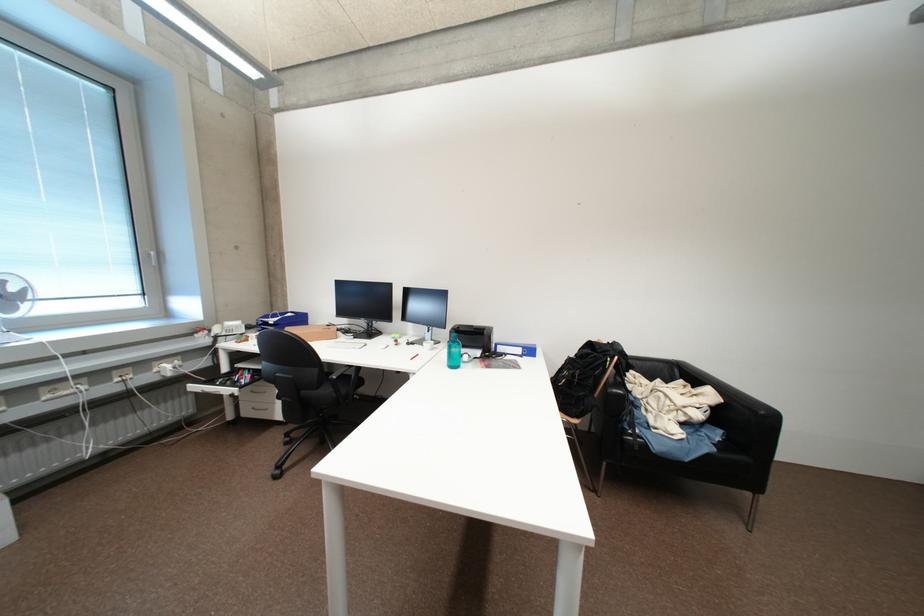
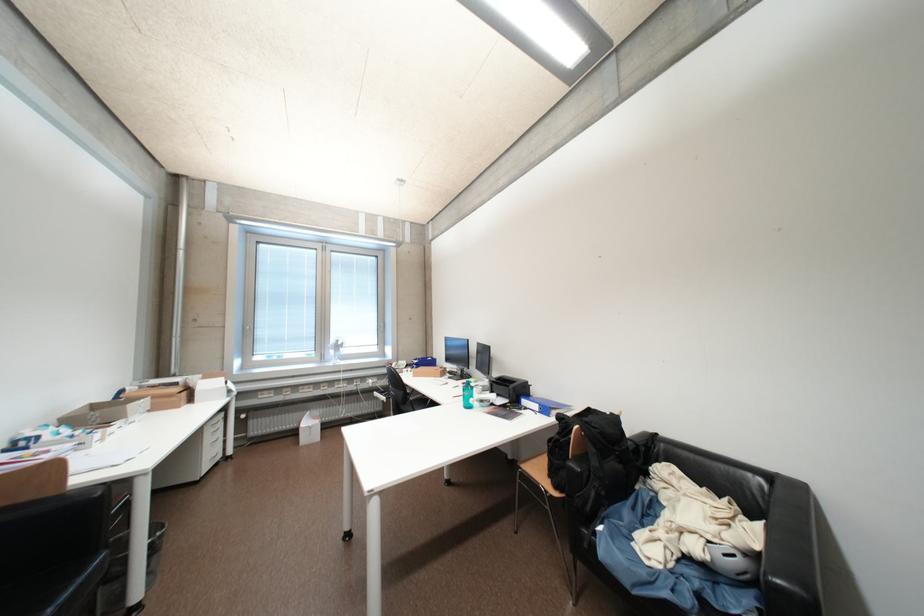
Locate, in the second image, the point that corresponds to (706,416) in the first image.

(704, 551)